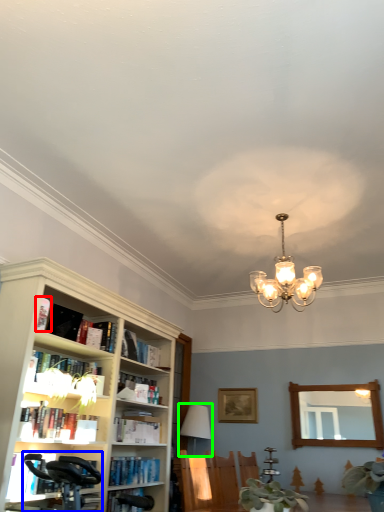
Question: Which object is the closest to the book (highlighted by a red box)? Choose among these: swivel chair (highlighted by a blue box) or lamp (highlighted by a green box).

Choices:
 (A) swivel chair
 (B) lamp

Answer: (A)